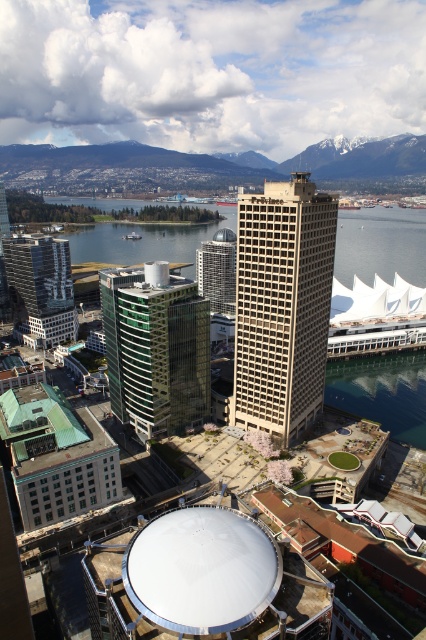
You are a drone operator trying to navigate between two points in the urban landscape. The first point is at coordinate point(57, 273) and the second point is at coordinate point(206, 280). Which point is closer to the observer?

Point(57, 273) is in front of point(206, 280), so it is closer to the observer.